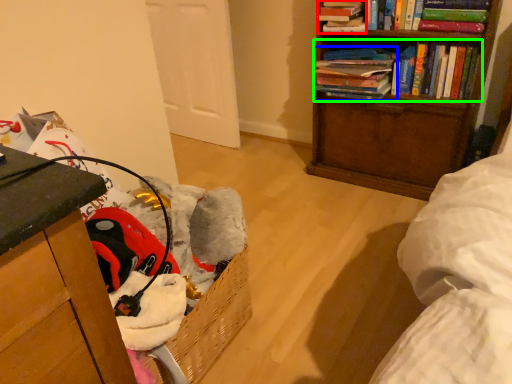
Question: Which is nearer to the book (highlighted by a red box)? book (highlighted by a blue box) or book (highlighted by a green box).

Choices:
 (A) book
 (B) book

Answer: (A)